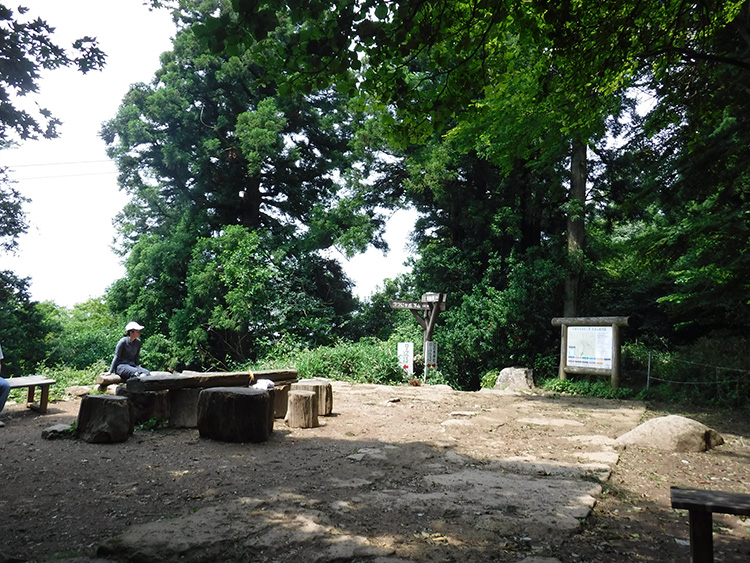
This screenshot has width=750, height=563. Find the location of `wooden frame`. wooden frame is located at coordinates (614, 329), (565, 321), (566, 368).